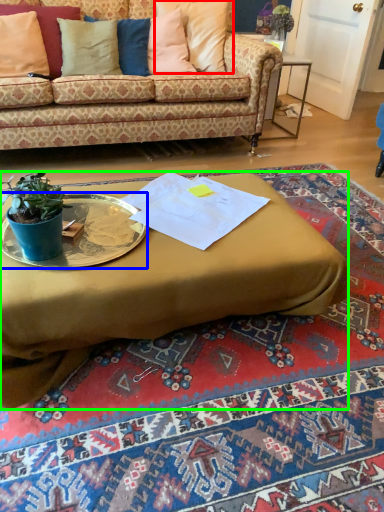
Question: Based on their relative distances, which object is nearer to pillow (highlighted by a red box)? Choose from platter (highlighted by a blue box) and coffee table (highlighted by a green box).

Choices:
 (A) platter
 (B) coffee table

Answer: (B)